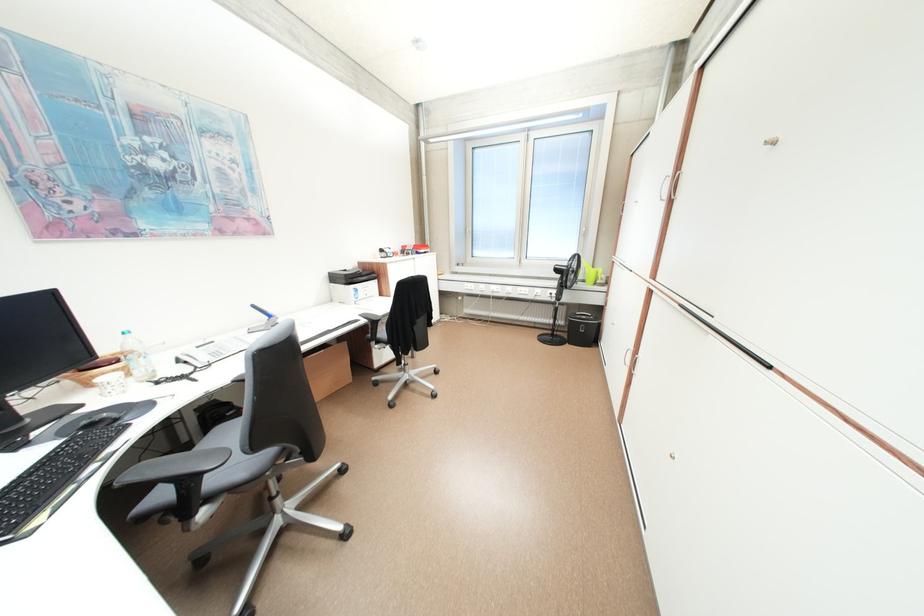
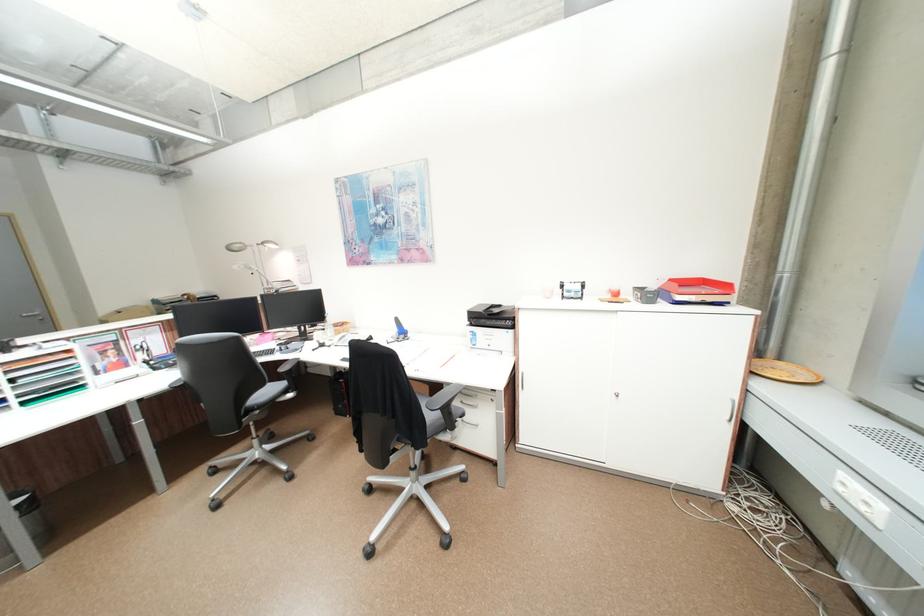
Question: I am providing you with two images of the same scene from different viewpoints. After the viewpoint changes to image2, which objects are now occluded?

Choices:
 (A) yellow-green cushion
 (B) black chair armrest
 (C) silver door handle
 (D) trash can

Answer: (B)